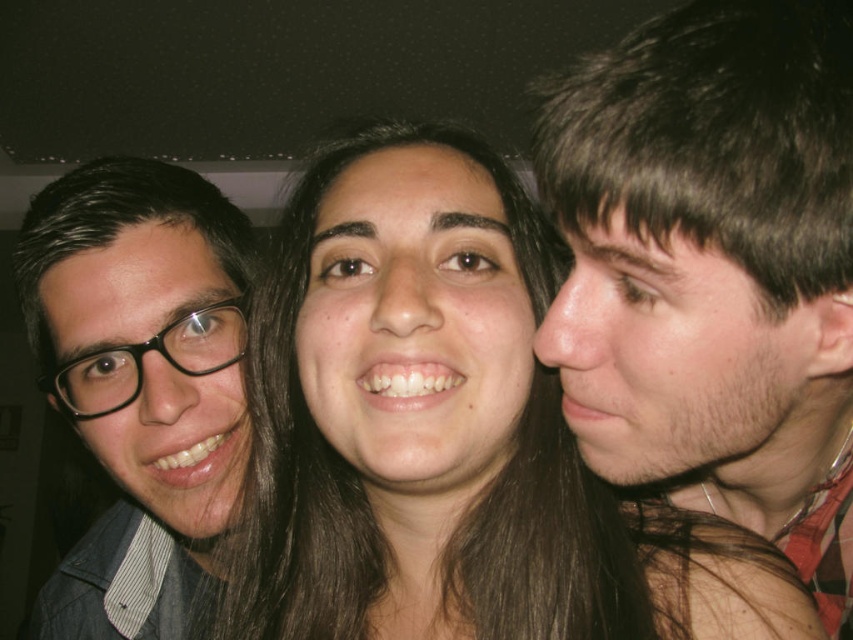
In the selfie, you want to place a sticker on the smooth skin face at right and the matte black glasses at left. If the sticker for the face is 2 cm tall and the sticker for the glasses is 3 cm tall, will both stickers fit without overlapping?

The smooth skin face at right is shorter than the matte black glasses at left. The sticker for the face is 2 cm tall and the sticker for the glasses is 3 cm tall. Since the face is shorter, the 2 cm sticker will fit, and the 3 cm sticker will also fit on the taller glasses. They won???t overlap as their positions are separate.

Looking at the three people in the selfie, which smooth skin face at right and smooth skin face at center has a higher position in the frame?

The smooth skin face at right is above the smooth skin face at center in the frame.

You are a photographer trying to focus on the smooth skin face at right. Based on the coordinates provided, where should you adjust your camera to focus?

The smooth skin face at right is located at coordinates point (714, 268), so adjust the camera focus to that point.